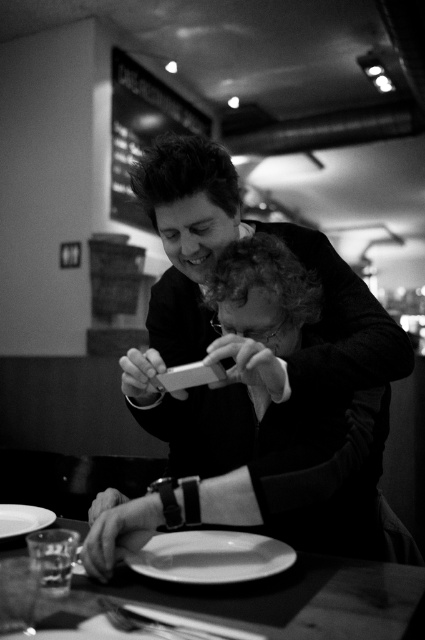
You are a customer at a restaurant and you want to place your phone on the table. The phone is 15 cm long. Can you confirm if the smooth wooden table at center has enough space to accommodate your phone without overlapping the white matte plate at lower left?

The smooth wooden table at center is larger in size than white matte plate at lower left, so there should be sufficient space to place the phone on the table without overlapping the plate.

You are standing in a restaurant and want to place your phone on the smooth wooden table at center. Where exactly should you place it?

You should place your phone at point coordinates (283,600) on the smooth wooden table at center as that is the exact location specified.

You are a photographer trying to capture the best angle of the smooth plastic phone at center in the image. Based on its position, where should you position yourself relative to the two people to ensure the phone is clearly visible in your shot?

The smooth plastic phone at center is located at point (255, 384), so positioning yourself slightly to the right and above the two individuals would allow you to capture the phone clearly without obstruction.